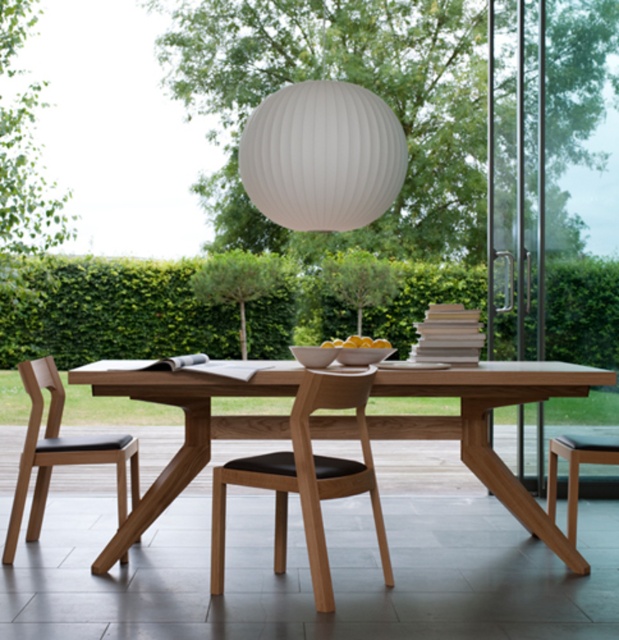
You are planning to hang a new decoration in the dining area. The decoration you have is 1 meter wide. You see the white ribbed paper lantern at upper center and the light brown wood chair at center. Based on their widths, can the decoration fit between them horizontally?

The white ribbed paper lantern at upper center is wider than the light brown wood chair at center. Since the decoration is 1 meter wide, it depends on the actual widths of both objects. However, without specific measurements, we cannot confirm if there is enough space between them for the decoration.

You are sitting at the dining table and want to reach the yellow matte bowl at center without moving your chair. Can you do it if the light brown wood chair at center is blocking your path?

The light brown wood chair at center is in front of the yellow matte bowl at center, so it is blocking the path. You cannot reach the yellow matte bowl at center without moving the chair.

You are sitting at the dining table and notice a light brown wood chair at center and a yellow matte bowl at center. Which object is positioned to the left of the other?

The light brown wood chair at center is to the left of yellow matte bowl at center.